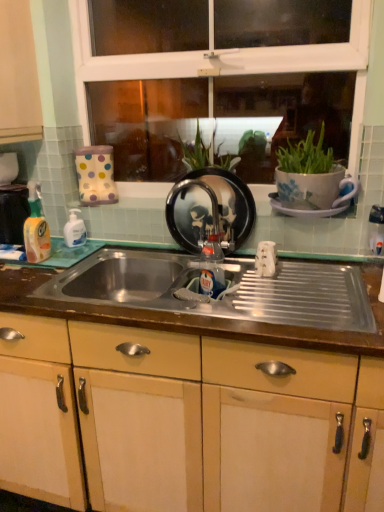
Locate an element on the screen. The height and width of the screenshot is (512, 384). free space in front of white glossy bottle at left, the 2th bottle in the right-to-left sequence is located at coordinates (67, 254).